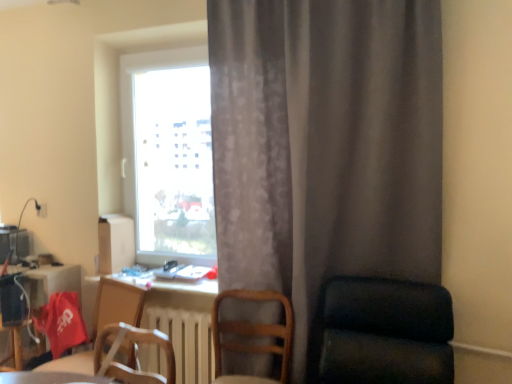
This screenshot has width=512, height=384. In order to click on free location above transparent glass window at center (from a real-world perspective) in this screenshot , I will do `click(154, 30)`.